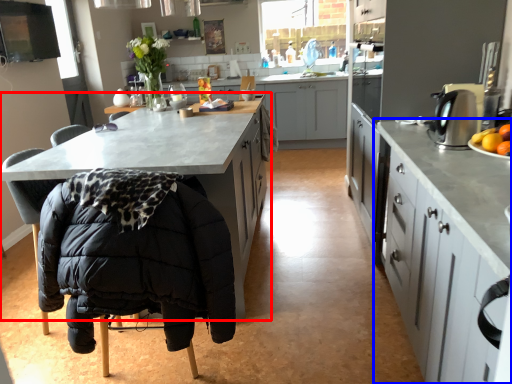
Question: Which point is closer to the camera, cabinetry (highlighted by a red box) or cabinetry (highlighted by a blue box)?

Choices:
 (A) cabinetry
 (B) cabinetry

Answer: (B)